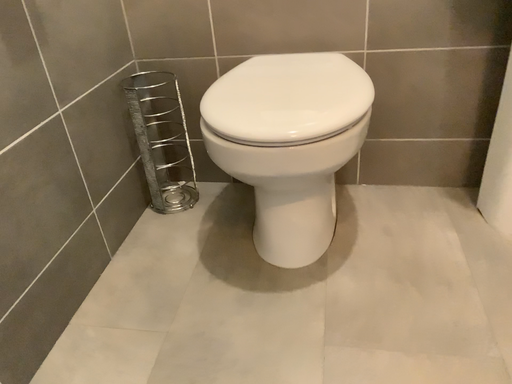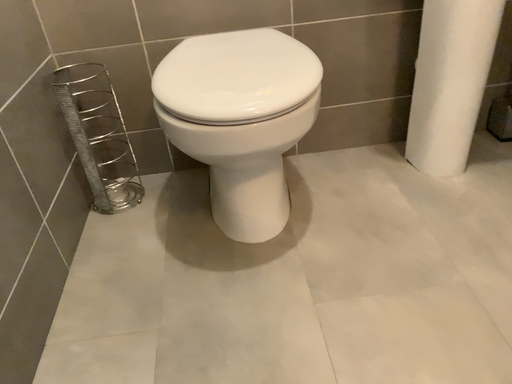
Question: Which way did the camera rotate in the video?

Choices:
 (A) rotated left
 (B) rotated right

Answer: (B)